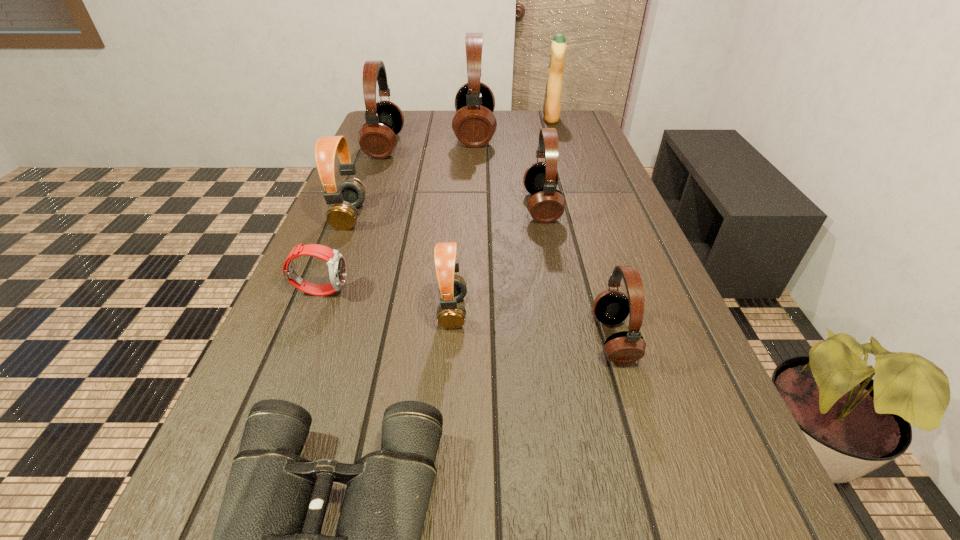
Locate an element on the screen. The height and width of the screenshot is (540, 960). vacant space located on the ear cups of the left brown headset is located at coordinates (507, 216).

Locate an element on the screen. This screenshot has height=540, width=960. free space located on the ear pads of the second smallest black headset is located at coordinates (493, 207).

You are a GUI agent. You are given a task and a screenshot of the screen. Output one action in this format:
    pyautogui.click(x=<x>, y=<y>)
    Task: Click on the free spot located on the ear pads of the second smallest black headset
    The width and height of the screenshot is (960, 540).
    Given the screenshot: What is the action you would take?
    pyautogui.click(x=396, y=207)

In order to click on vacant region located 0.350m on the ear pads of the second smallest black headset in this screenshot , I will do `click(389, 207)`.

Find the location of `free point located on the ear cups of the right brown headset`. free point located on the ear cups of the right brown headset is located at coordinates (523, 312).

Find the location of a particular element. Image resolution: width=960 pixels, height=540 pixels. free space located on the ear pads of the nearest black headset is located at coordinates (535, 339).

Locate an element on the screen. This screenshot has width=960, height=540. vacant space located 0.050m on the ear pads of the nearest black headset is located at coordinates click(x=567, y=339).

I want to click on vacant region located on the ear pads of the nearest black headset, so click(502, 339).

What are the coordinates of `vacant area situated 0.310m on the face of the red watch` in the screenshot? It's located at (498, 290).

Image resolution: width=960 pixels, height=540 pixels. I want to click on detergent that is at the far edge, so click(552, 100).